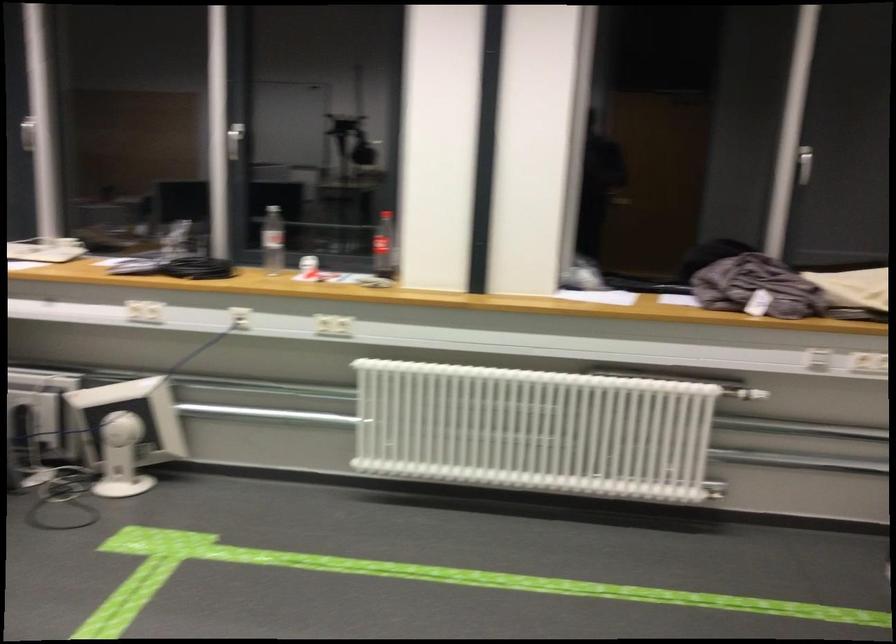
What do you see at coordinates (751, 395) in the screenshot?
I see `the white radiator knob` at bounding box center [751, 395].